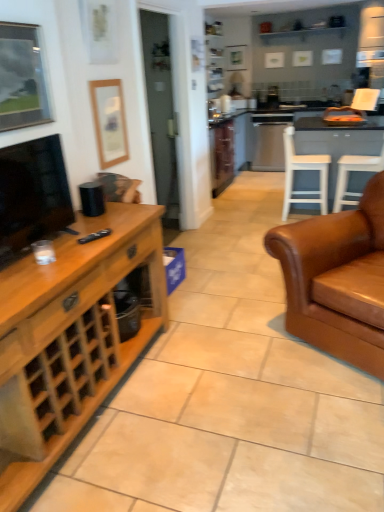
Where is `free location in front of black matte remote at center`? This screenshot has width=384, height=512. free location in front of black matte remote at center is located at coordinates (84, 248).